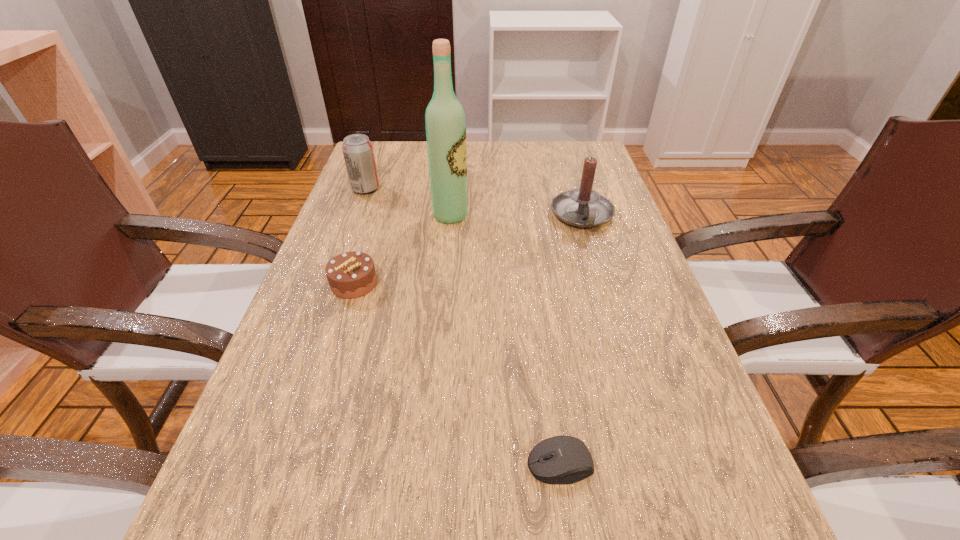
Image resolution: width=960 pixels, height=540 pixels. In order to click on wine bottle in this screenshot , I will do `click(445, 124)`.

Where is `the third object from left to right`? the third object from left to right is located at coordinates (445, 124).

I want to click on the rightmost object, so coord(583,207).

Where is `soda can`? soda can is located at coordinates (358, 151).

Where is `chocolate cake`? This screenshot has height=540, width=960. chocolate cake is located at coordinates (352, 274).

The image size is (960, 540). Identify the location of the fourth tallest object. (352, 274).

Locate an element on the screen. The image size is (960, 540). the fourth object from left to right is located at coordinates (562, 459).

Find the location of a particular element. Image resolution: width=960 pixels, height=540 pixels. the shortest object is located at coordinates (562, 459).

I want to click on free space located 0.360m on the front-facing side of the wine bottle, so click(610, 215).

What are the coordinates of `vacant space situated on the side of the candle with the handle loop` in the screenshot? It's located at (616, 329).